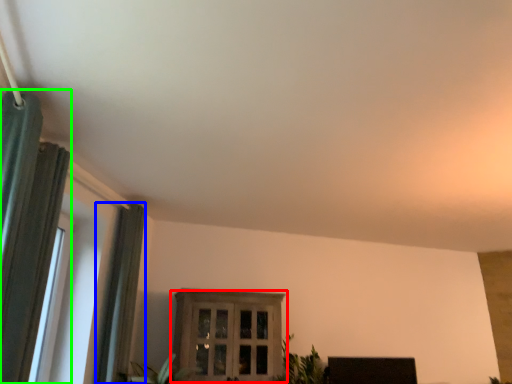
Question: Based on their relative distances, which object is farther from window (highlighted by a red box)? Choose from curtain (highlighted by a blue box) and curtain (highlighted by a green box).

Choices:
 (A) curtain
 (B) curtain

Answer: (B)